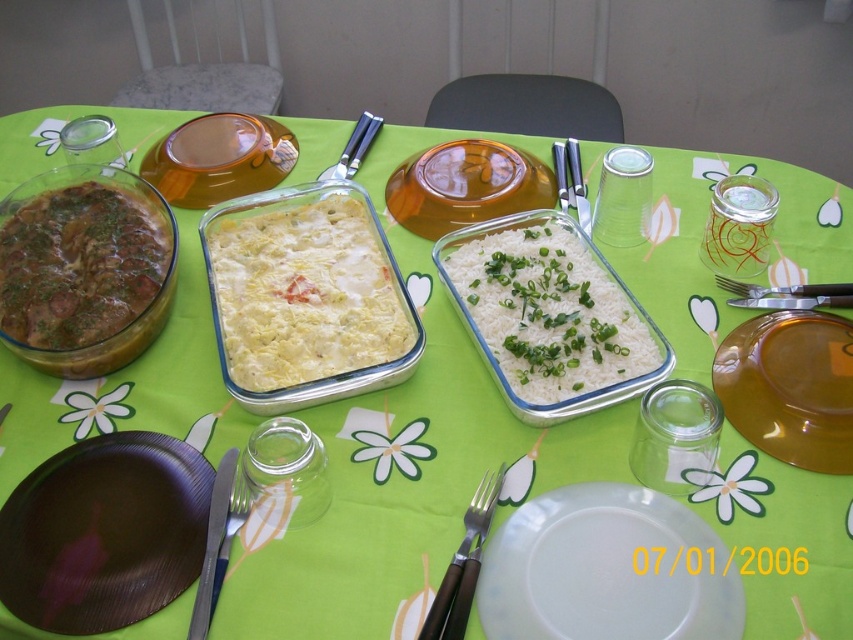
You are a diner sitting at the table and want to reach for the silver metallic fork at lower left. However, there is a translucent glass platter at center in your way. Can you still reach the fork without moving the platter?

The translucent glass platter at center is bigger than the silver metallic fork at lower left, but this does not necessarily block access to it. Since the platter is at the center and the fork is at the lower left, you can still reach the fork by navigating around the platter without moving it.

Looking at this image, you are a server who needs to place a 17 inch long silverware holder between the translucent glass platter at center and the silver metallic fork at lower left. Can you fit it there?

The distance between the translucent glass platter at center and the silver metallic fork at lower left is 17.31 inches, so yes, the 17 inch silverware holder can fit between them since it is slightly shorter than the available space.

You are a guest at the table and want to reach for the silver metallic fork at lower left. Which direction should you move your hand relative to the brown glossy stew at left?

The brown glossy stew at left is positioned on the left side of the silver metallic fork at lower left, so you should move your hand to the right from the brown glossy stew at left to reach the silver metallic fork at lower left.